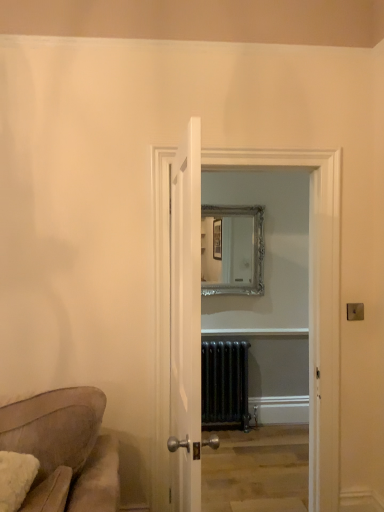
Question: Visually, is silver/gilded mirror at center positioned to the left or to the right of black metal radiator at center?

Choices:
 (A) left
 (B) right

Answer: (B)

Question: Looking at their shapes, would you say silver/gilded mirror at center is wider or thinner than black metal radiator at center?

Choices:
 (A) thin
 (B) wide

Answer: (A)

Question: Based on their relative distances, which object is nearer to the metallic gold light switch at upper right?

Choices:
 (A) white wooden door at center
 (B) clear glass door at center
 (C) black metal radiator at center
 (D) silver/gilded mirror at center

Answer: (B)

Question: Considering the real-world distances, which object is closest to the silver/gilded mirror at center?

Choices:
 (A) clear glass door at center
 (B) white wooden door at center
 (C) metallic gold light switch at upper right
 (D) black metal radiator at center

Answer: (D)